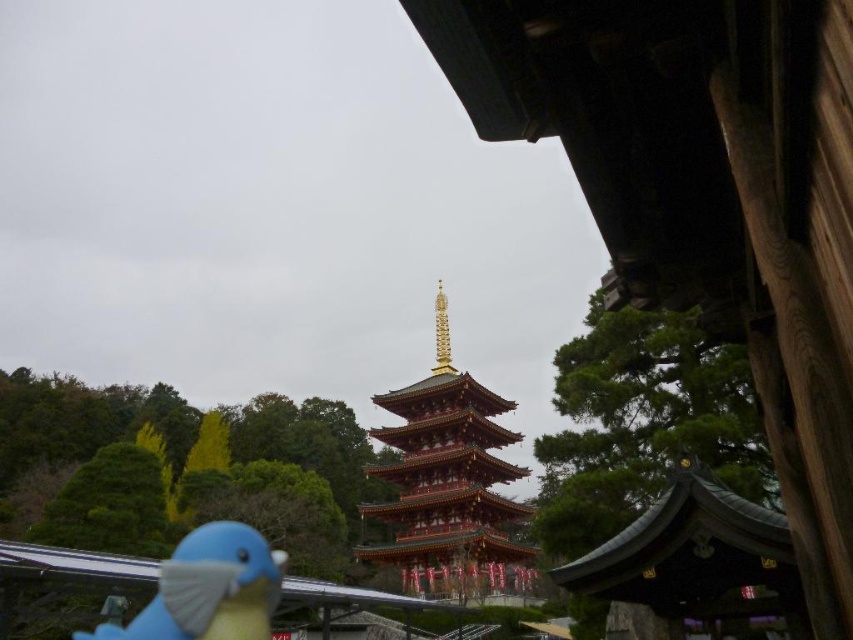
Does point (466, 451) come farther from viewer compared to point (270, 568)?

Yes, it is.

Does red lacquered pagoda at center have a smaller size compared to blue matte parrot at lower left?

Actually, red lacquered pagoda at center might be larger than blue matte parrot at lower left.

Between point (479, 470) and point (216, 618), which one is positioned behind?

The point (479, 470) is more distant.

Find the location of a particular element. This screenshot has height=640, width=853. red lacquered pagoda at center is located at coordinates (448, 483).